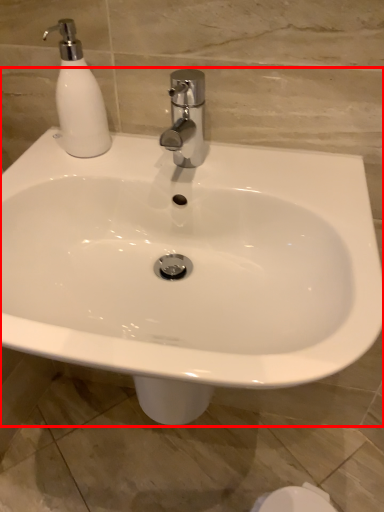
Question: From the image's perspective, where is sink (annotated by the red box) located in relation to soap dispenser in the image?

Choices:
 (A) above
 (B) below

Answer: (B)